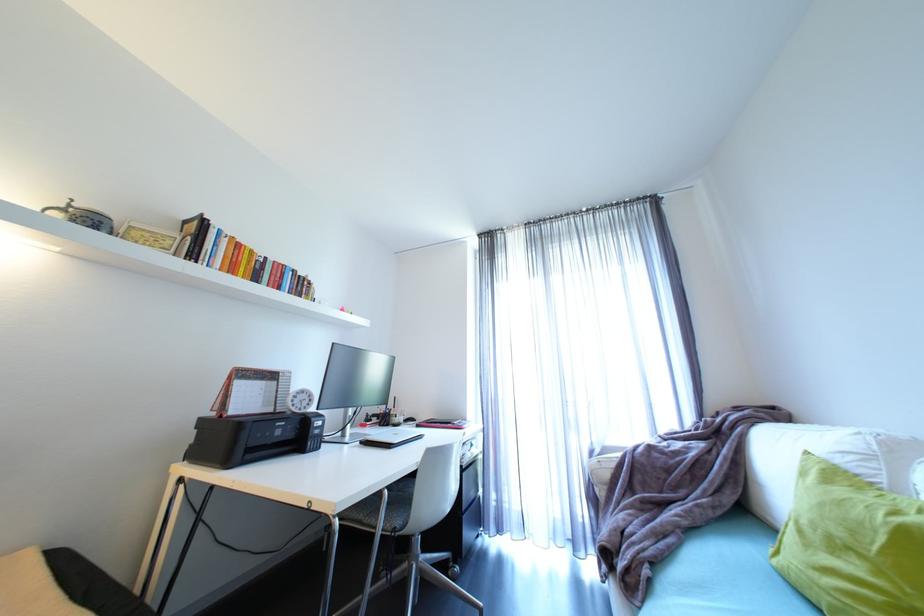
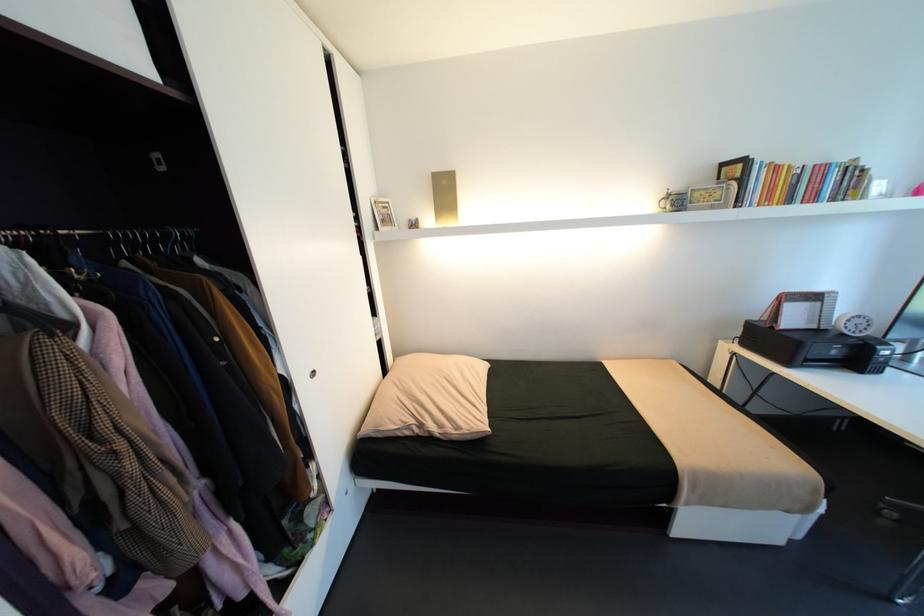
Locate, in the second image, the point that corresponds to point 228,416 in the first image.

(779, 328)